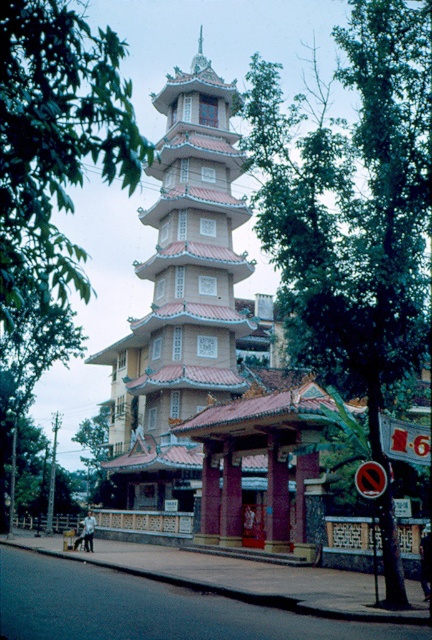
Which is in front, point (40, 76) or point (256, 410)?

Point (40, 76)

The image size is (432, 640). What do you see at coordinates (54, 164) in the screenshot?
I see `green leafy tree at upper left` at bounding box center [54, 164].

Find the location of `green leafy tree at upper left`. green leafy tree at upper left is located at coordinates tap(54, 164).

Between point (324, 189) and point (199, 241), which one is positioned in front?

Point (324, 189)

At what (x,y) coordinates should I click in order to perform the action: click on green leafy tree at center. Please return your answer as a coordinate pair (x, y). Looking at the image, I should click on (352, 209).

Can you confirm if beige textured pagoda at center is positioned above green leafy tree at upper left?

No.

Does beige textured pagoda at center have a greater width compared to green leafy tree at upper left?

Incorrect, beige textured pagoda at center's width does not surpass green leafy tree at upper left's.

Which is behind, point (152, 384) or point (47, 307)?

Point (152, 384)

This screenshot has width=432, height=640. What are the coordinates of `beige textured pagoda at center` in the screenshot? It's located at (183, 300).